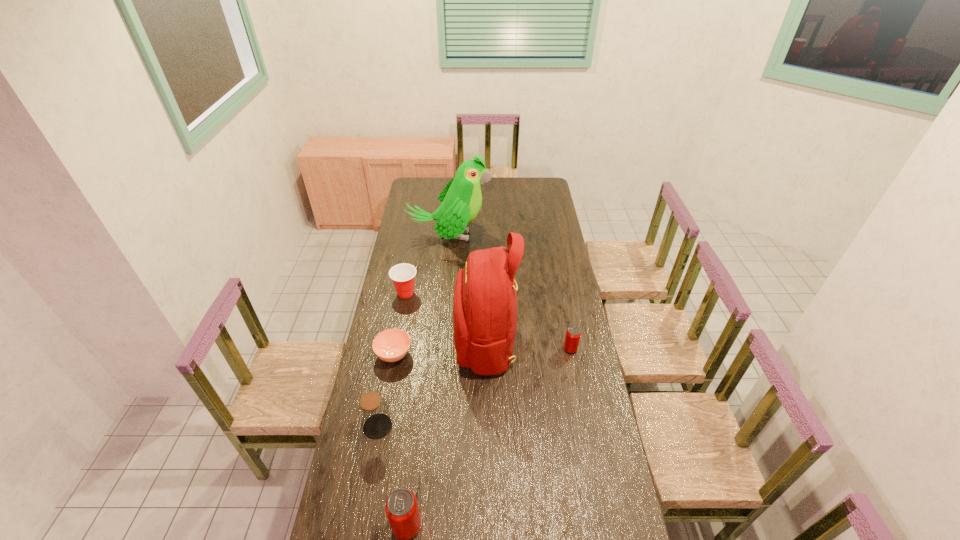
The height and width of the screenshot is (540, 960). I want to click on free space located 0.220m on the front-facing side of the backpack, so click(x=404, y=340).

The image size is (960, 540). In order to click on vacant space situated 0.070m on the front-facing side of the backpack in this screenshot , I will do `click(439, 340)`.

Image resolution: width=960 pixels, height=540 pixels. I want to click on vacant region located on the front of the shortest object, so [x=383, y=416].

Find the location of `free spot located on the right of the second nearest object`. free spot located on the right of the second nearest object is located at coordinates (424, 426).

The image size is (960, 540). What are the coordinates of `vacant space located 0.290m on the back of the second farthest object` in the screenshot? It's located at (414, 248).

The height and width of the screenshot is (540, 960). What are the coordinates of `parakeet located in the left edge section of the desktop` in the screenshot? It's located at (461, 199).

Identify the location of soup bowl that is at the left edge. This screenshot has height=540, width=960. (391, 345).

Identify the location of jar that is at the left edge. The height and width of the screenshot is (540, 960). (373, 412).

The image size is (960, 540). I want to click on cup located at the left edge, so click(x=403, y=275).

Image resolution: width=960 pixels, height=540 pixels. Identify the location of object located in the right edge section of the desktop. (573, 333).